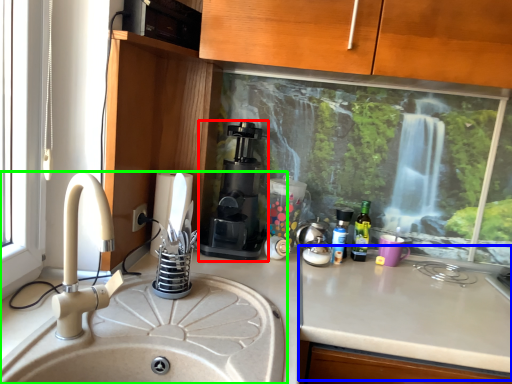
Question: Which object is the farthest from coffee machine (highlighted by a red box)? Choose among these: counter top (highlighted by a blue box) or sink (highlighted by a green box).

Choices:
 (A) counter top
 (B) sink

Answer: (A)